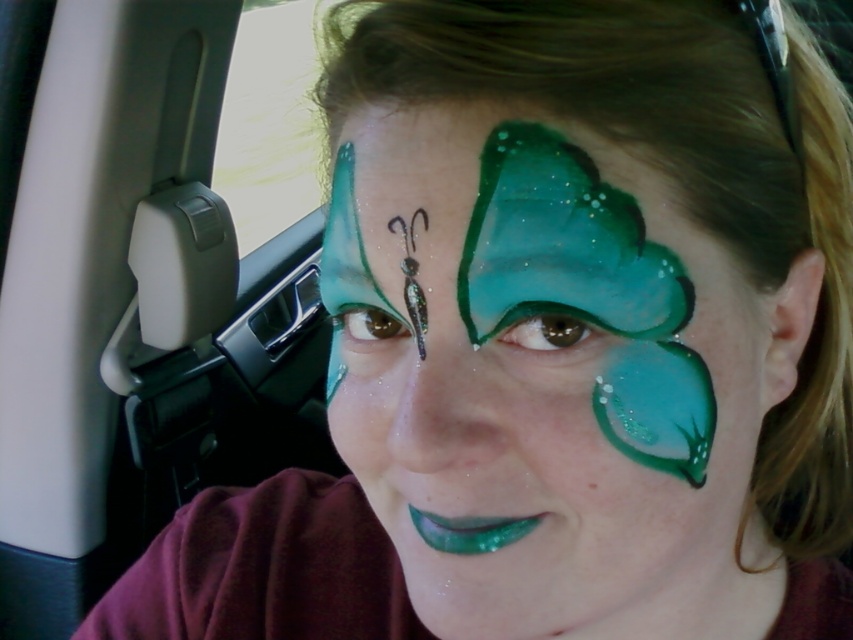
Who is shorter, shiny green paint at center or transparent glass car window at upper left?

shiny green paint at center is shorter.

Looking at this image, can you confirm if shiny green paint at center is bigger than transparent glass car window at upper left?

No, shiny green paint at center is not bigger than transparent glass car window at upper left.

The height and width of the screenshot is (640, 853). In order to click on shiny green paint at center in this screenshot , I will do `click(543, 378)`.